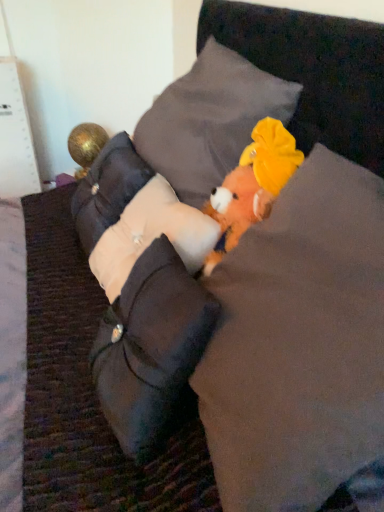
Question: Considering their positions, is fluffy orange plush toy at center located in front of or behind white fabric pillow at center, which ranks as the fourth pillow in top-to-bottom order?

Choices:
 (A) behind
 (B) front

Answer: (B)

Question: Is fluffy orange plush toy at center to the left or to the right of white fabric pillow at center, the 1th pillow ordered from the bottom, in the image?

Choices:
 (A) right
 (B) left

Answer: (A)

Question: Estimate the real-world distances between objects in this image. Which object is closer to the white fabric pillow at center, which ranks as the fourth pillow in top-to-bottom order?

Choices:
 (A) velvet gray pillow at center, which ranks as the 4th pillow in bottom-to-top order
 (B) fluffy orange plush toy at center
 (C) gold metallic ball at left, marked as the second toy in a right-to-left arrangement
 (D) beige fabric pillow at left, the 3th pillow in the bottom-to-top sequence
 (E) fluffy orange plush toy at center, the second toy when ordered from back to front

Answer: (B)

Question: Which of these objects is positioned closest to the beige fabric pillow at left, the 3th pillow in the bottom-to-top sequence?

Choices:
 (A) white fabric pillow at center, the 2th pillow when ordered from bottom to top
 (B) velvet gray pillow at center, positioned as the first pillow in top-to-bottom order
 (C) fluffy orange plush toy at center
 (D) fluffy orange plush toy at center, the second toy when ordered from back to front
 (E) white fabric pillow at center, which ranks as the fourth pillow in top-to-bottom order

Answer: (A)